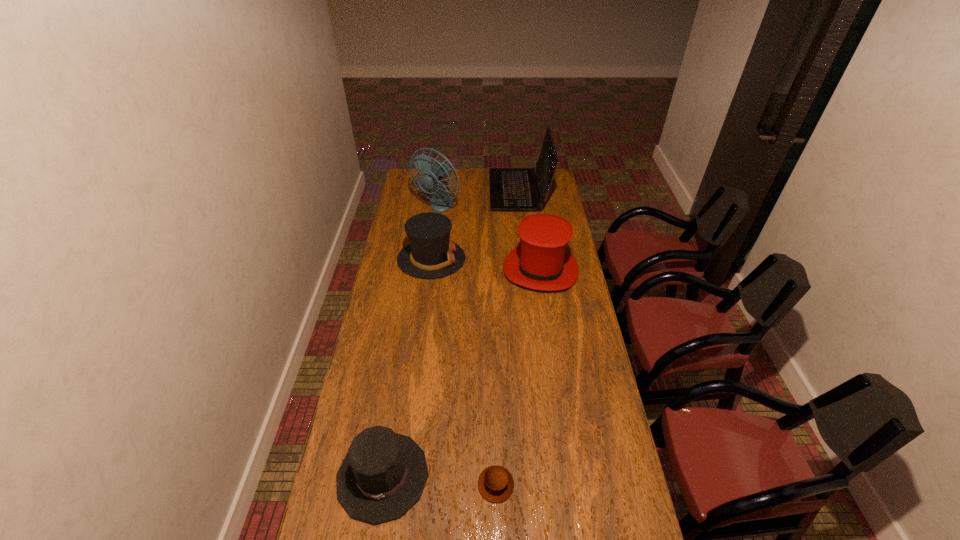
This screenshot has height=540, width=960. Find the location of `vacant position at the right edge of the desktop`. vacant position at the right edge of the desktop is located at coordinates (612, 439).

Where is `empty space between the tallest dress hat and the shortest object`? The width and height of the screenshot is (960, 540). empty space between the tallest dress hat and the shortest object is located at coordinates (518, 377).

Locate an element on the screen. The image size is (960, 540). free point between the shortest object and the rightmost dress hat is located at coordinates (518, 377).

Image resolution: width=960 pixels, height=540 pixels. Identify the location of unoccupied position between the shortest dress hat and the second tallest object. (451, 333).

Locate an element on the screen. This screenshot has height=540, width=960. the closest object to the third tallest object is located at coordinates (431, 254).

Identify the location of object that stands as the second closest to the shortest dress hat. (541, 262).

Image resolution: width=960 pixels, height=540 pixels. Find the location of `dress hat that stands as the third closest to the tallest object`. dress hat that stands as the third closest to the tallest object is located at coordinates (383, 474).

Where is `dress hat that is the second closest to the fan`? The width and height of the screenshot is (960, 540). dress hat that is the second closest to the fan is located at coordinates (541, 262).

At what (x,y) coordinates should I click in order to perform the action: click on vacant position in the image that satisfies the following two spatial constraints: 1. in front of the fan to blow air; 2. on the left side of the tallest dress hat. Please return your answer as a coordinate pair (x, y). This screenshot has height=540, width=960. Looking at the image, I should click on (429, 269).

Image resolution: width=960 pixels, height=540 pixels. Find the location of `free location that satisfies the following two spatial constraints: 1. on the screen of the second tallest object; 2. in front of the tallest object to blow air`. free location that satisfies the following two spatial constraints: 1. on the screen of the second tallest object; 2. in front of the tallest object to blow air is located at coordinates (521, 206).